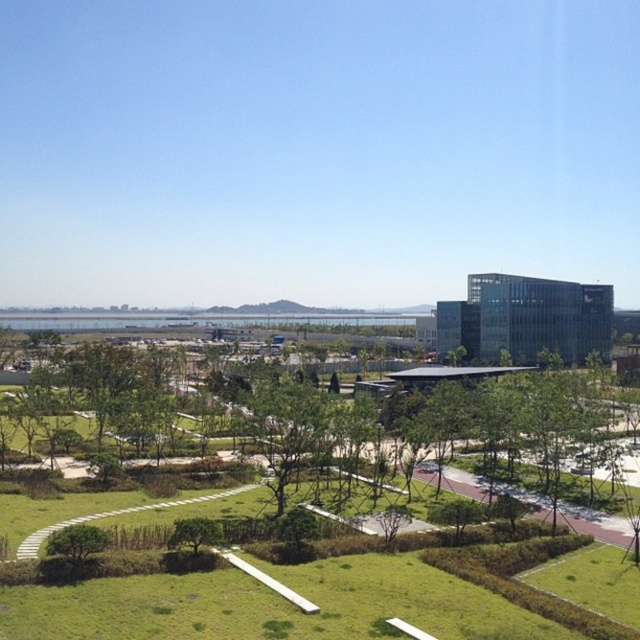
In the scene shown: You are standing at the edge of the green grassy park at center and want to walk to the green leafy tree at lower center. Is the tree closer to you or farther away?

The green leafy tree at lower center is farther away from you than the green grassy park at center, so the tree is farther away.

You are standing in the park and see the green leafy tree at lower left and the green leafy tree at lower center. Which tree is positioned higher in the image?

The green leafy tree at lower left is positioned higher in the image than the green leafy tree at lower center.

You are standing in the park and want to take a photo of both the point at coordinates point [61,536] and the point at coordinates point [172,540]. Which point should you focus on first to ensure both are in clear view?

You should focus on point [61,536] first because it is closer to the camera than point [172,540], ensuring both points are in clear view.